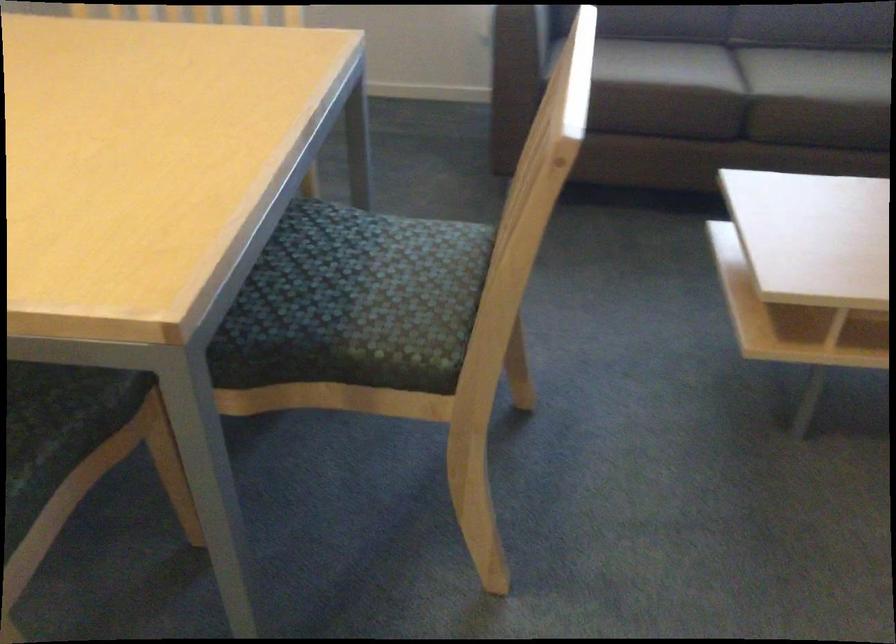
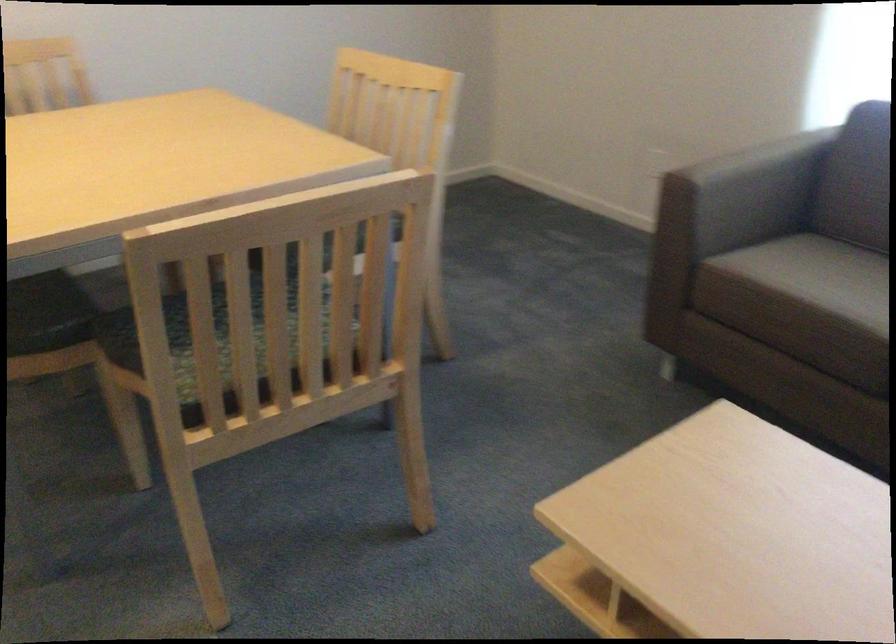
Find the pixel in the second image that matches (90,377) in the first image.

(47, 313)